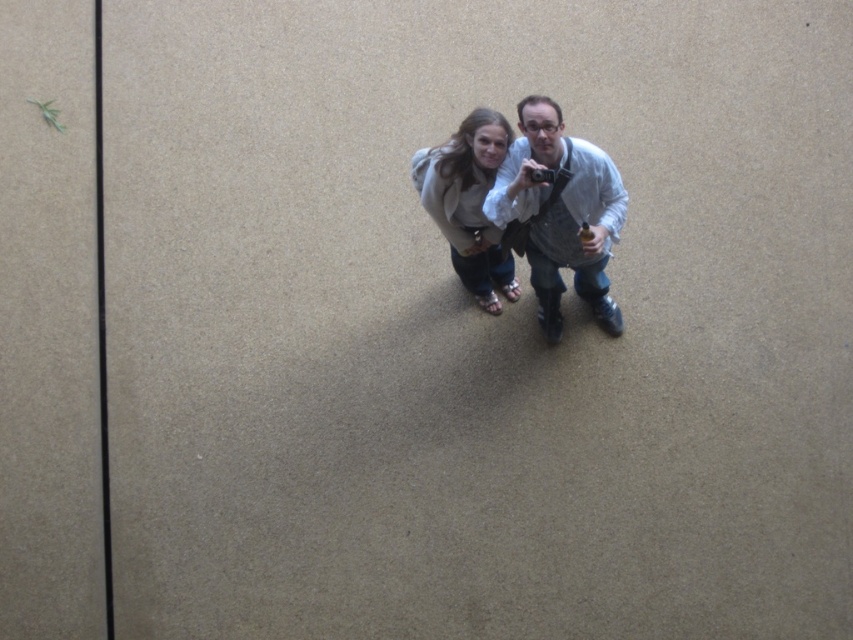
Is white shirt at center taller than light beige sweater at center?

Correct, white shirt at center is much taller as light beige sweater at center.

I want to click on white shirt at center, so click(561, 212).

Find the location of a particular element. This screenshot has width=853, height=640. white shirt at center is located at coordinates (561, 212).

Where is `white shirt at center`? white shirt at center is located at coordinates (561, 212).